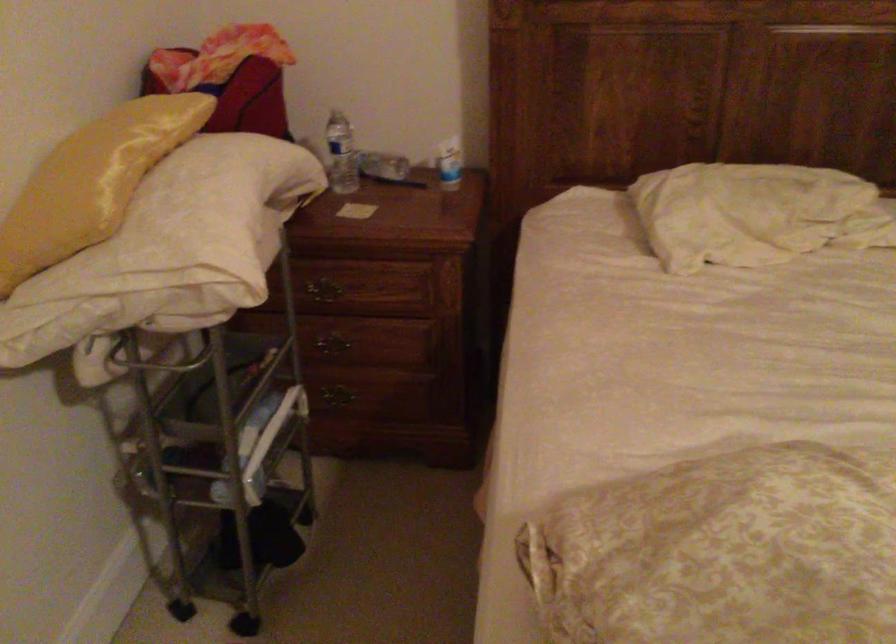
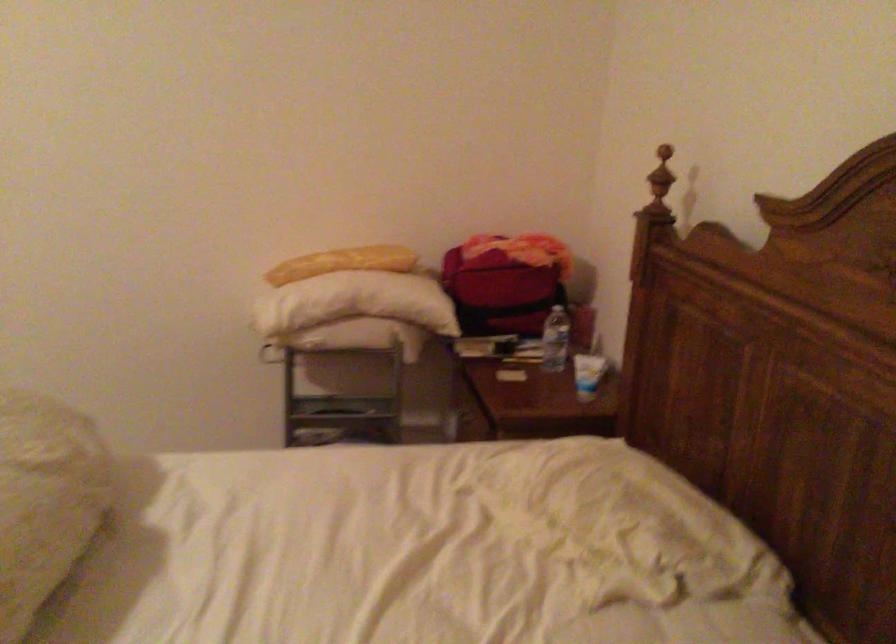
Where in the second image is the point corresponding to the point at 364,149 from the first image?

(556, 339)